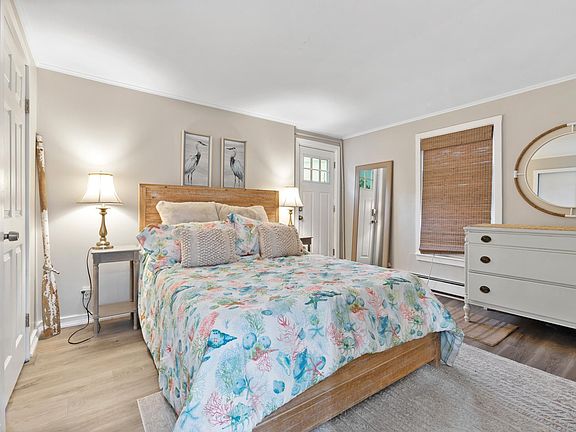
The height and width of the screenshot is (432, 576). I want to click on window, so click(325, 177), click(314, 176), click(306, 174), click(309, 161), click(317, 160), click(325, 165), click(460, 199).